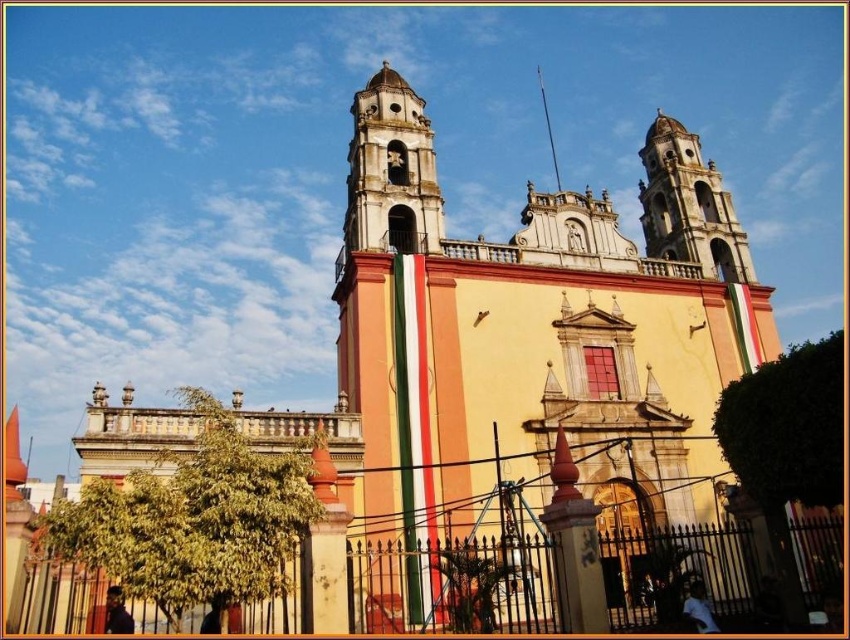
You are a painter standing at the entrance of the church. You want to paint the iron gate at lower center and the smooth stone bell tower at upper right. Which object should you focus on first if you want to capture the wider structure in your painting?

The iron gate at lower center should be focused on first because its width is larger than the smooth stone bell tower at upper right.

You are a visitor standing at the entrance of the church and want to take a photo of the iron gate at lower center and the smooth stone bell tower at upper right. Which object will appear larger in the photo?

The smooth stone bell tower at upper right will appear larger in the photo because it is taller than the iron gate at lower center.

You are standing in front of the church and notice two bell towers. The white stone bell tower at center and the smooth stone bell tower at upper right. Which one is positioned more to the left side of the church?

The white stone bell tower at center is positioned more to the left side of the church compared to the smooth stone bell tower at upper right.